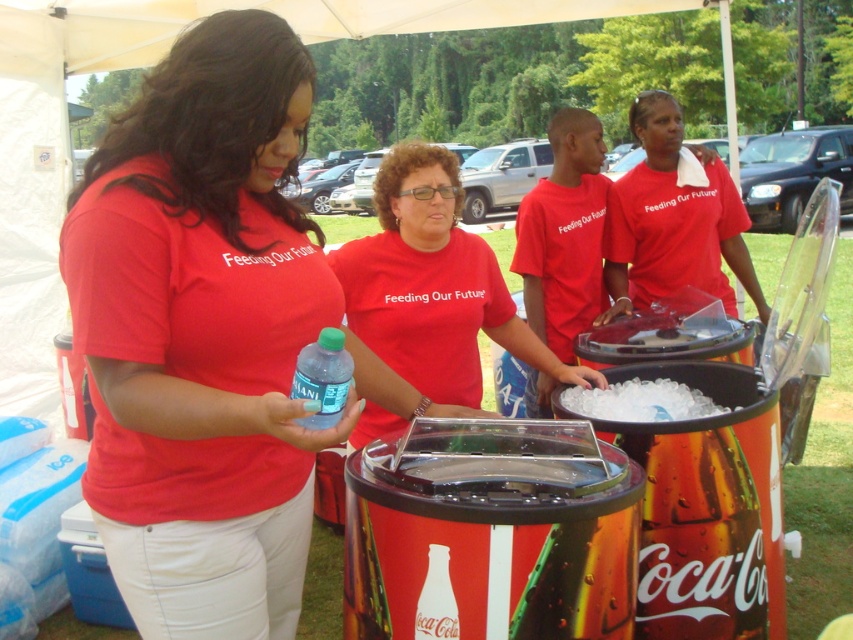
You are organizing a community event and need to know which container is taller between the clear plastic ice at center and the clear plastic bottle at center. Based on the scene description, which one is taller?

The clear plastic bottle at center is taller than the clear plastic ice at center according to the description.

You are standing at point A, which is at coordinates point (x=345, y=372). You want to walk to point B, which is at coordinates point (x=679, y=419). Based on the scene description, will you be moving towards the front or the back of the group of people?

Based on the scene description, point (x=679, y=419) is behind point (x=345, y=372). Therefore, moving from point (x=345, y=372) to point (x=679, y=419) would mean you are moving towards the back of the group of people.